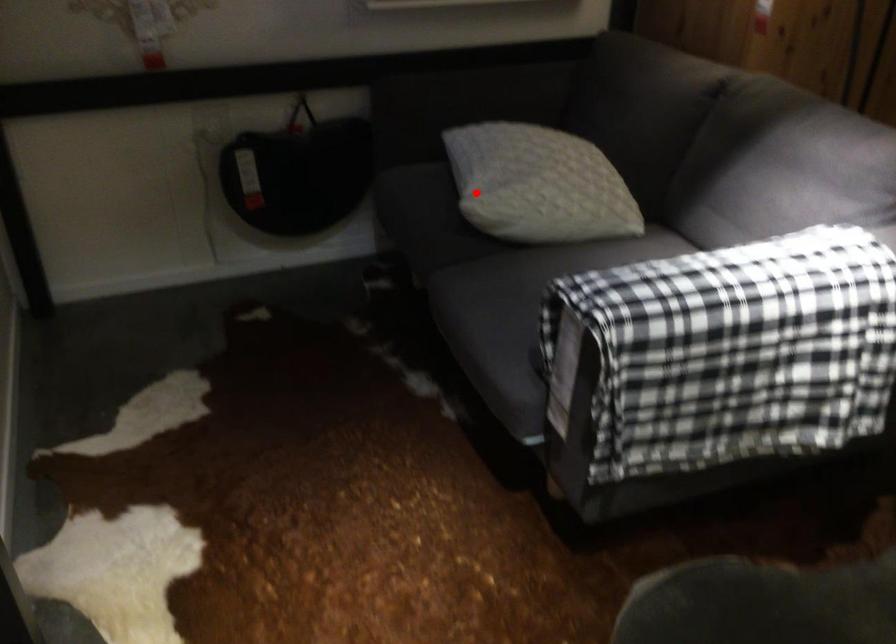
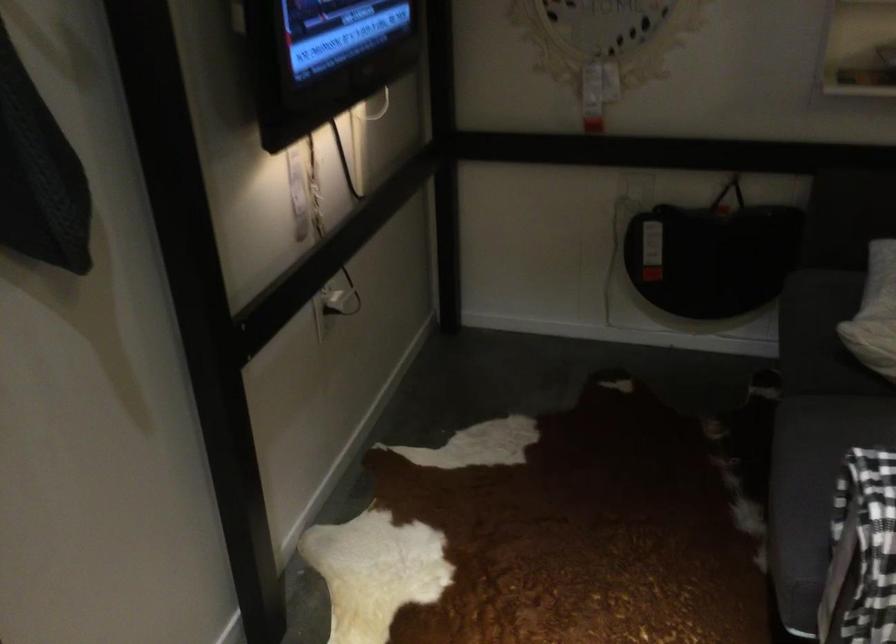
Question: I am providing you with two images of the same scene from different viewpoints. Given a red point in image1, look at the same physical point in image2. Is it:

Choices:
 (A) Closer to the viewpoint
 (B) Farther from the viewpoint

Answer: (A)